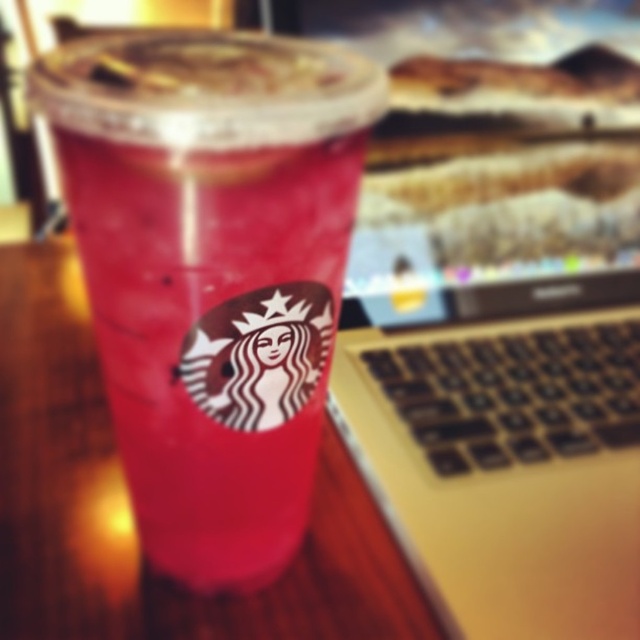
The image size is (640, 640). Describe the element at coordinates (499, 305) in the screenshot. I see `silver metallic laptop at center` at that location.

Does silver metallic laptop at center come behind pink paper cup at center?

Yes, it is.

Identify the location of silver metallic laptop at center. The height and width of the screenshot is (640, 640). (499, 305).